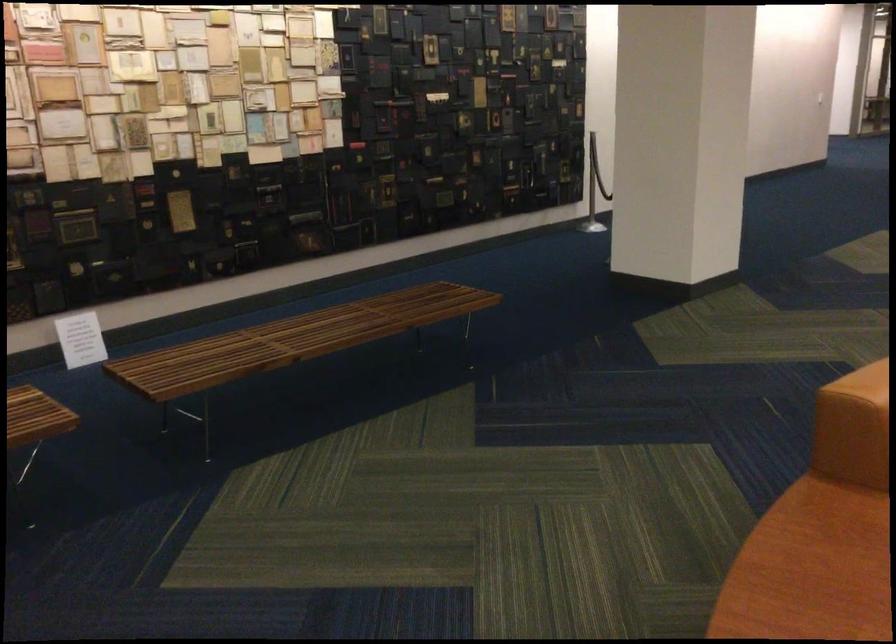
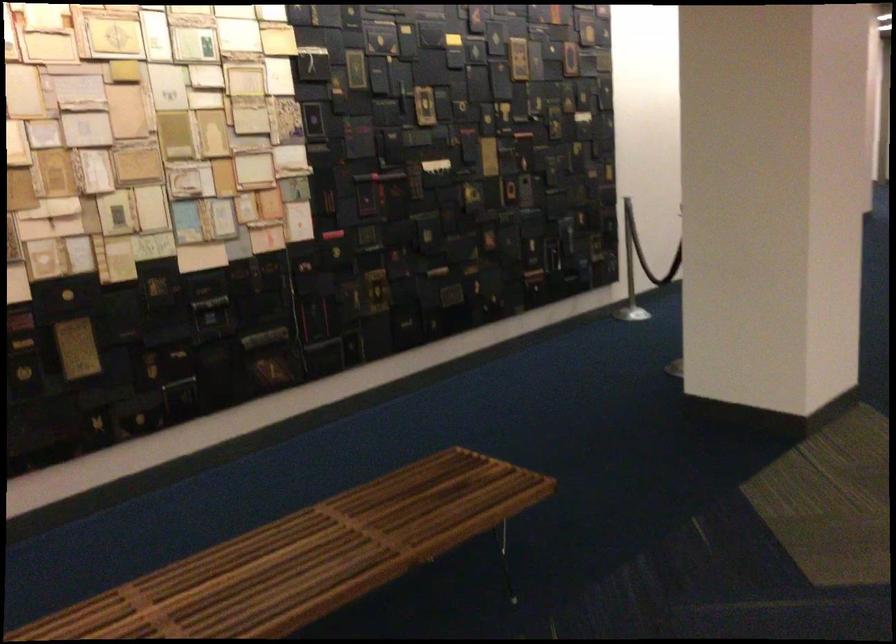
Question: In a continuous first-person perspective shot, in which direction is the camera moving?

Choices:
 (A) Left
 (B) Right
 (C) Forward
 (D) Backward

Answer: (C)